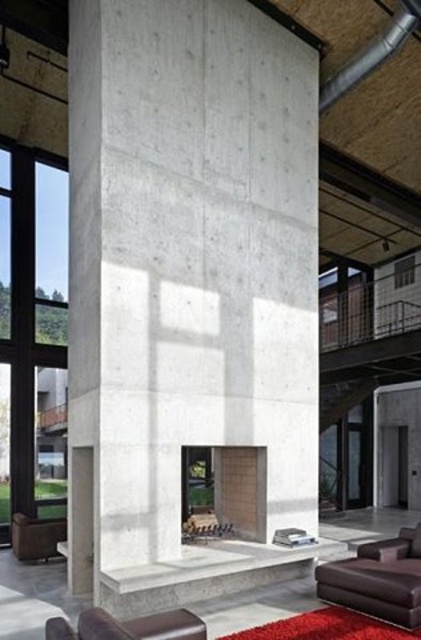
Question: Does smooth concrete fireplace at center have a lesser width compared to leather couch at lower right?

Choices:
 (A) no
 (B) yes

Answer: (B)

Question: Among these objects, which one is nearest to the camera?

Choices:
 (A) clear glass window at upper center
 (B) matte concrete fireplace at lower center
 (C) leather couch at lower right
 (D) brown leather armchair at lower left

Answer: (C)

Question: Does transparent glass window at left have a lesser width compared to leather couch at lower right?

Choices:
 (A) yes
 (B) no

Answer: (A)

Question: Based on their relative distances, which object is nearer to the brown leather armchair at lower left?

Choices:
 (A) matte concrete fireplace at lower center
 (B) clear glass window at upper center
 (C) leather couch at lower right
 (D) transparent glass window at left

Answer: (D)

Question: Which point appears closest to the camera in this image?

Choices:
 (A) (18, 557)
 (B) (402, 260)
 (C) (325, 570)

Answer: (C)

Question: Can you confirm if smooth concrete fireplace at center is positioned to the right of matte concrete fireplace at lower center?

Choices:
 (A) no
 (B) yes

Answer: (A)